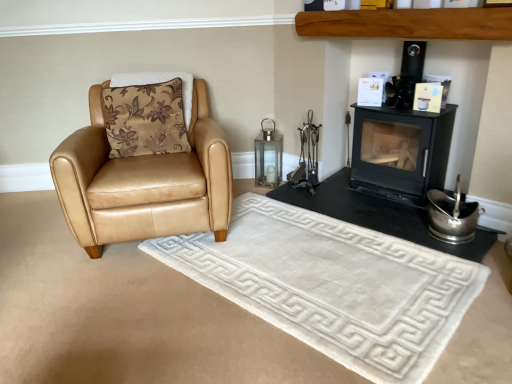
Locate an element on the screen. free space in front of tan leather armchair at left is located at coordinates (117, 306).